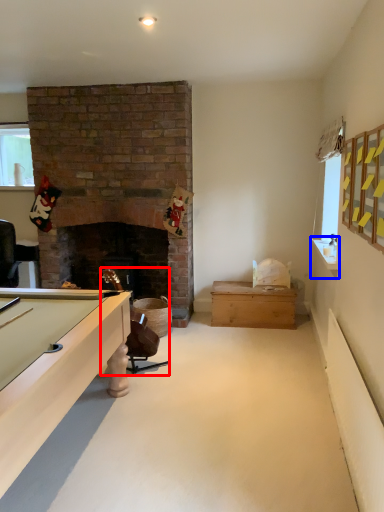
Question: Which object is further to the camera taking this photo, chair (highlighted by a red box) or counter top (highlighted by a blue box)?

Choices:
 (A) chair
 (B) counter top

Answer: (A)